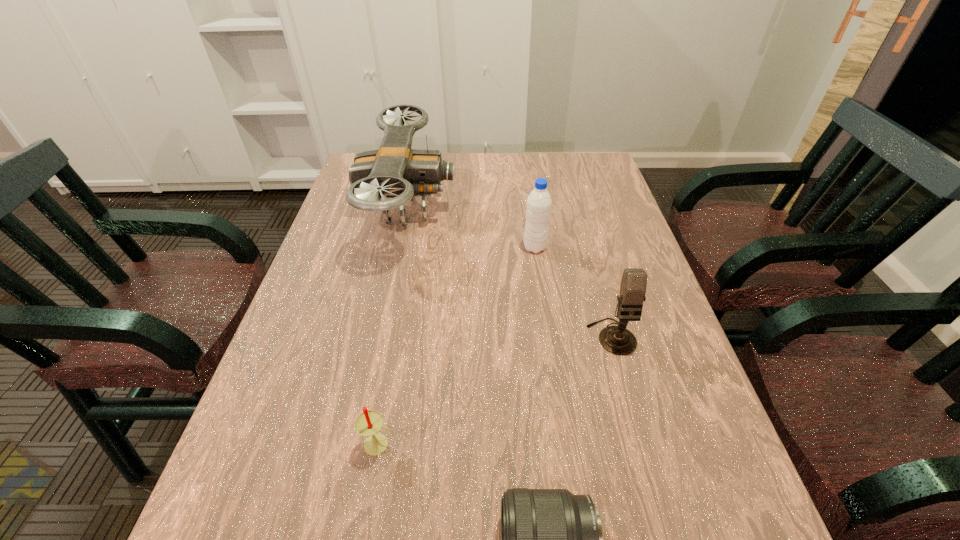
The image size is (960, 540). Find the location of `drone`. drone is located at coordinates (396, 171).

Identify the location of water bottle. This screenshot has width=960, height=540. (538, 208).

The image size is (960, 540). Find the location of `the third nearest object`. the third nearest object is located at coordinates (618, 340).

Where is `microphone`? This screenshot has height=540, width=960. microphone is located at coordinates (618, 340).

Identify the location of the fourth farthest object. (368, 423).

Identify the location of free region located 0.220m on the front-facing side of the drone. The height and width of the screenshot is (540, 960). (529, 211).

The width and height of the screenshot is (960, 540). In order to click on vacant space located on the front of the water bottle in this screenshot , I will do `click(552, 371)`.

Where is `vacant space located 0.260m on the front-facing side of the microphone`? The image size is (960, 540). vacant space located 0.260m on the front-facing side of the microphone is located at coordinates (x=652, y=480).

The width and height of the screenshot is (960, 540). I want to click on free space located 0.210m on the right of the fourth farthest object, so click(514, 444).

At what (x,y) coordinates should I click in order to perform the action: click on object at the far edge. Please return your answer as a coordinate pair (x, y). Image resolution: width=960 pixels, height=540 pixels. Looking at the image, I should click on (396, 171).